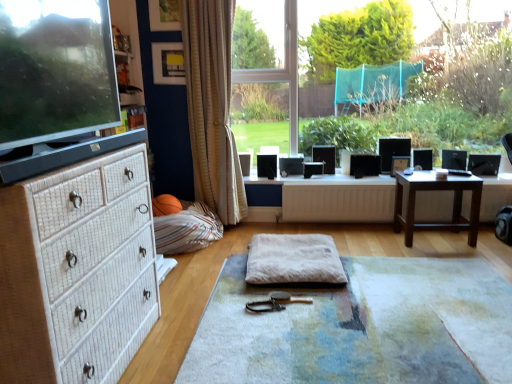
Locate an element on the screen. This screenshot has height=384, width=512. vacant space underneath brown wooden table at right (from a real-world perspective) is located at coordinates (x=435, y=239).